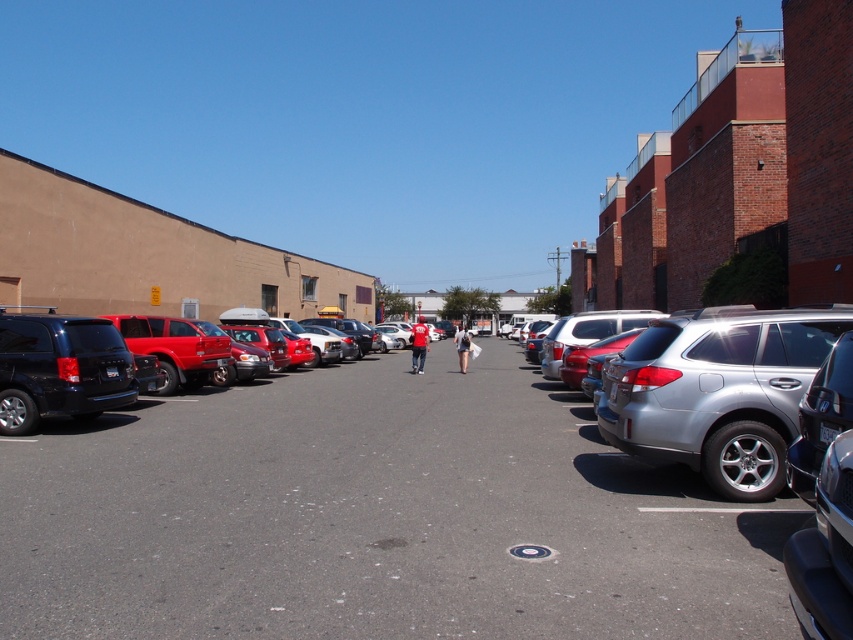
You are a delivery driver who needs to park your truck, which is 6 meters long, in the parking lot. Looking at the shiny black car at center and the matte black minivan at left, which vehicle takes up more space in the parking lot?

The shiny black car at center is bigger than the matte black minivan at left, so it takes up more space in the parking lot.

You are a delivery driver with a truck that is 3 meters wide. You need to navigate between the shiny black car at center and the matte black minivan at left to reach the loading zone. Can your truck fit through the gap between them?

The gap between the shiny black car at center and the matte black minivan at left is 2.67 meters. Since your truck is 3 meters wide, it is wider than the available space, so it cannot fit through the gap between the shiny black car at center and the matte black minivan at left.

You are a parking attendant who needs to move the shiny black car at center and the matte black minivan at left. Which vehicle should you move first to allow the other to exit the parking spot?

You should move the matte black minivan at left first because the shiny black car at center is positioned to its right, so moving the minivan first will allow the car to exit without obstruction.